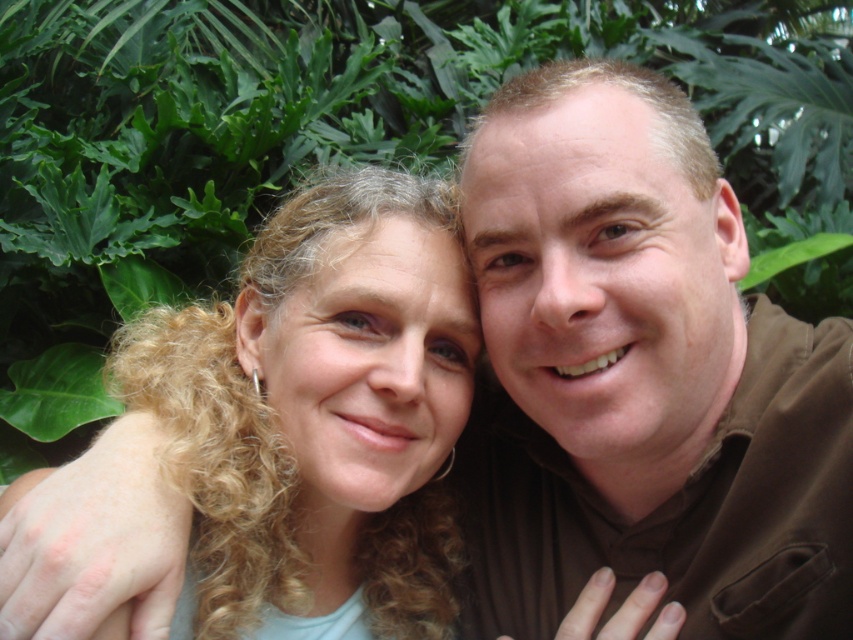
Question: Where is brown smooth shirt at center located in relation to curly blonde hair at center in the image?

Choices:
 (A) above
 (B) below

Answer: (A)

Question: Does brown smooth shirt at center have a larger size compared to curly blonde hair at center?

Choices:
 (A) no
 (B) yes

Answer: (B)

Question: Which point is farther to the camera?

Choices:
 (A) curly blonde hair at center
 (B) brown smooth shirt at center

Answer: (A)

Question: Which point is closer to the camera?

Choices:
 (A) brown smooth shirt at center
 (B) curly blonde hair at center

Answer: (A)

Question: In this image, where is brown smooth shirt at center located relative to curly blonde hair at center?

Choices:
 (A) right
 (B) left

Answer: (A)